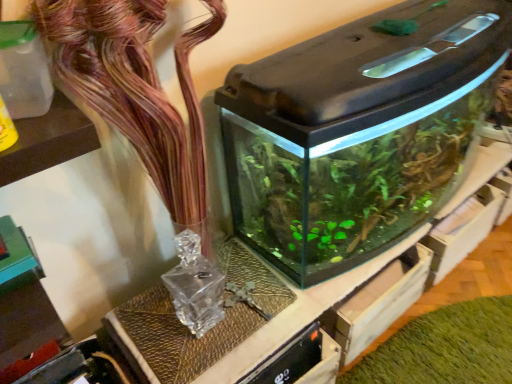
Question: Can you confirm if translucent glass vase at upper center is thinner than transparent glass water tank at center?

Choices:
 (A) no
 (B) yes

Answer: (B)

Question: From a real-world perspective, is translucent glass vase at upper center physically above transparent glass water tank at center?

Choices:
 (A) no
 (B) yes

Answer: (B)

Question: Considering the relative sizes of translucent glass vase at upper center and transparent glass water tank at center in the image provided, is translucent glass vase at upper center wider than transparent glass water tank at center?

Choices:
 (A) yes
 (B) no

Answer: (B)

Question: Is translucent glass vase at upper center facing away from transparent glass water tank at center?

Choices:
 (A) yes
 (B) no

Answer: (B)

Question: Would you say translucent glass vase at upper center is a long distance from transparent glass water tank at center?

Choices:
 (A) yes
 (B) no

Answer: (B)

Question: Is translucent glass vase at upper center taller than transparent glass water tank at center?

Choices:
 (A) yes
 (B) no

Answer: (A)

Question: From a real-world perspective, is transparent glass water tank at center located higher than green matte plant at lower right?

Choices:
 (A) no
 (B) yes

Answer: (B)

Question: Could you tell me if transparent glass water tank at center is facing green matte plant at lower right?

Choices:
 (A) no
 (B) yes

Answer: (A)

Question: Considering the relative sizes of transparent glass water tank at center and green matte plant at lower right in the image provided, is transparent glass water tank at center taller than green matte plant at lower right?

Choices:
 (A) yes
 (B) no

Answer: (A)

Question: From a real-world perspective, is transparent glass water tank at center positioned under green matte plant at lower right based on gravity?

Choices:
 (A) no
 (B) yes

Answer: (A)

Question: Is transparent glass water tank at center looking in the opposite direction of green matte plant at lower right?

Choices:
 (A) no
 (B) yes

Answer: (A)

Question: Does transparent glass water tank at center have a smaller size compared to green matte plant at lower right?

Choices:
 (A) yes
 (B) no

Answer: (B)

Question: From the image's perspective, is green matte plant at lower right on top of translucent glass vase at upper center?

Choices:
 (A) yes
 (B) no

Answer: (B)